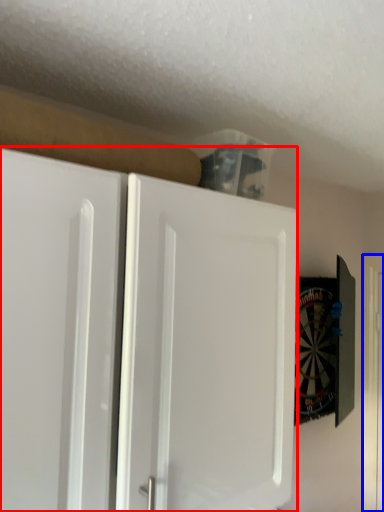
Question: Among these objects, which one is nearest to the camera, cabinetry (highlighted by a red box) or door (highlighted by a blue box)?

Choices:
 (A) cabinetry
 (B) door

Answer: (A)